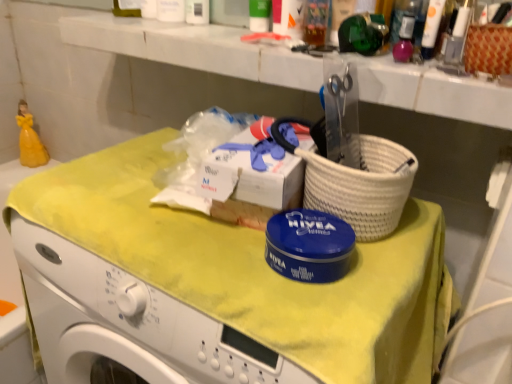
Find the location of a particular element. The width and height of the screenshot is (512, 384). free space above yellow fabric at center (from a real-world perspective) is located at coordinates point(182,211).